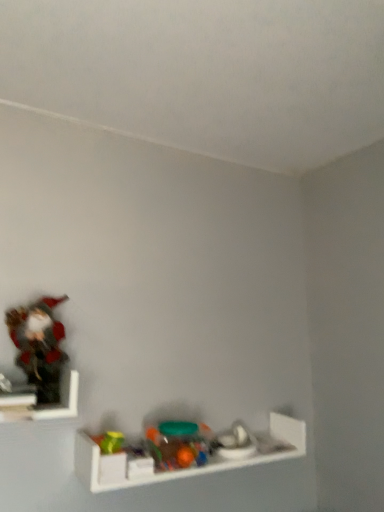
Question: From the image's perspective, does translucent plastic toys at center, the second toy when ordered from right to left, appear higher than translucent plastic toy at lower center, placed as the third toy when sorted from left to right?

Choices:
 (A) no
 (B) yes

Answer: (B)

Question: Is the position of translucent plastic toys at center, acting as the 2th toy starting from the top, more distant than that of translucent plastic toy at lower center, placed as the third toy when sorted from left to right?

Choices:
 (A) yes
 (B) no

Answer: (B)

Question: Considering the relative sizes of translucent plastic toys at center, the second toy from the left, and translucent plastic toy at lower center, marked as the 1th toy in a bottom-to-top arrangement, in the image provided, is translucent plastic toys at center, the second toy from the left, shorter than translucent plastic toy at lower center, marked as the 1th toy in a bottom-to-top arrangement,?

Choices:
 (A) yes
 (B) no

Answer: (B)

Question: Is translucent plastic toys at center, the second toy from the left, oriented towards translucent plastic toy at lower center, the first toy positioned from the right?

Choices:
 (A) yes
 (B) no

Answer: (B)

Question: Is the depth of translucent plastic toys at center, the second toy when ordered from right to left, less than that of translucent plastic toy at lower center, the first toy positioned from the right?

Choices:
 (A) yes
 (B) no

Answer: (A)

Question: Is wooden figurine at left, which is counted as the first shelf, starting from the left, inside the boundaries of matte plastic figurine at left, the 3th toy viewed from the right, or outside?

Choices:
 (A) inside
 (B) outside

Answer: (A)

Question: In terms of height, does wooden figurine at left, the 1th shelf when ordered from top to bottom, look taller or shorter compared to matte plastic figurine at left, arranged as the 1th toy when viewed from the top?

Choices:
 (A) tall
 (B) short

Answer: (B)

Question: Does point click(x=76, y=397) appear closer or farther from the camera than point click(x=34, y=306)?

Choices:
 (A) farther
 (B) closer

Answer: (A)

Question: From the image's perspective, is wooden figurine at left, the 1th shelf when ordered from top to bottom, above or below matte plastic figurine at left, acting as the 1th toy starting from the left?

Choices:
 (A) below
 (B) above

Answer: (A)

Question: From the image's perspective, is matte plastic figurine at left, arranged as the 1th toy when viewed from the top, positioned above or below translucent plastic toys at center, the second toy when ordered from right to left?

Choices:
 (A) above
 (B) below

Answer: (A)

Question: Is matte plastic figurine at left, arranged as the 1th toy when viewed from the top, to the left or to the right of translucent plastic toys at center, acting as the 2th toy starting from the top, in the image?

Choices:
 (A) left
 (B) right

Answer: (A)

Question: Is point (13, 321) positioned closer to the camera than point (201, 458)?

Choices:
 (A) farther
 (B) closer

Answer: (B)

Question: Do you think matte plastic figurine at left, acting as the 1th toy starting from the left, is within translucent plastic toys at center, the second toy when ordered from right to left, or outside of it?

Choices:
 (A) outside
 (B) inside

Answer: (A)

Question: Looking at their shapes, would you say translucent plastic toys at center, acting as the 2th toy starting from the top, is wider or thinner than translucent plastic toy at lower center, placed as the third toy when sorted from left to right?

Choices:
 (A) thin
 (B) wide

Answer: (A)

Question: Does point (185, 452) appear closer or farther from the camera than point (221, 451)?

Choices:
 (A) closer
 (B) farther

Answer: (A)